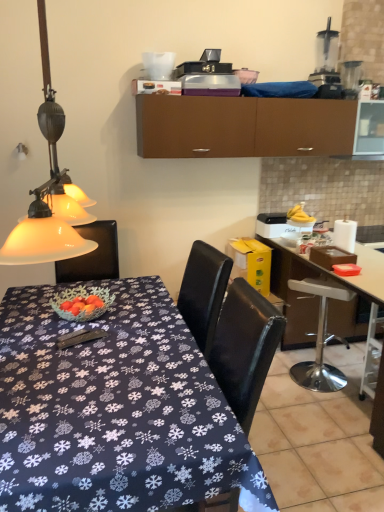
Question: From a real-world perspective, is white glossy desk at right, which is the 2th desk from left to right, beneath transparent plastic blender at upper right, the 2th appliance from the right?

Choices:
 (A) yes
 (B) no

Answer: (A)

Question: Does white glossy desk at right, arranged as the 1th desk when viewed from the right, come in front of transparent plastic blender at upper right, the 2th appliance from the right?

Choices:
 (A) yes
 (B) no

Answer: (A)

Question: Considering the relative sizes of white glossy desk at right, arranged as the 1th desk when viewed from the right, and transparent plastic blender at upper right, the 2th appliance from the right, in the image provided, is white glossy desk at right, arranged as the 1th desk when viewed from the right, bigger than transparent plastic blender at upper right, the 2th appliance from the right,?

Choices:
 (A) yes
 (B) no

Answer: (A)

Question: Is white glossy desk at right, which is the 2th desk from left to right, located outside transparent plastic blender at upper right, the 2th appliance from the right?

Choices:
 (A) no
 (B) yes

Answer: (B)

Question: Is white glossy desk at right, which is the 2th desk from left to right, to the right of transparent plastic blender at upper right, arranged as the first appliance when viewed from the left, from the viewer's perspective?

Choices:
 (A) yes
 (B) no

Answer: (A)

Question: Considering the positions of matte glass lampshade at left and dark blue fabric table at center, which appears as the first desk when viewed from the left, in the image, is matte glass lampshade at left bigger or smaller than dark blue fabric table at center, which appears as the first desk when viewed from the left,?

Choices:
 (A) small
 (B) big

Answer: (A)

Question: Do you think matte glass lampshade at left is within dark blue fabric table at center, which is the second desk in right-to-left order, or outside of it?

Choices:
 (A) outside
 (B) inside

Answer: (A)

Question: Is point (52, 180) positioned closer to the camera than point (104, 286)?

Choices:
 (A) farther
 (B) closer

Answer: (B)

Question: Would you say matte glass lampshade at left is to the left or to the right of dark blue fabric table at center, which is the second desk in right-to-left order, in the picture?

Choices:
 (A) right
 (B) left

Answer: (B)

Question: In the image, is dark blue fabric table at center, which is the second desk in right-to-left order, on the left side or the right side of white glossy desk at right, arranged as the 1th desk when viewed from the right?

Choices:
 (A) left
 (B) right

Answer: (A)

Question: From the image's perspective, is dark blue fabric table at center, which is the second desk in right-to-left order, located above or below white glossy desk at right, which is the 2th desk from left to right?

Choices:
 (A) below
 (B) above

Answer: (A)

Question: Relative to white glossy desk at right, which is the 2th desk from left to right, is dark blue fabric table at center, which appears as the first desk when viewed from the left, in front or behind?

Choices:
 (A) behind
 (B) front

Answer: (B)

Question: From a real-world perspective, is dark blue fabric table at center, which appears as the first desk when viewed from the left, positioned above or below white glossy desk at right, arranged as the 1th desk when viewed from the right?

Choices:
 (A) above
 (B) below

Answer: (B)

Question: Is white plastic chair at right spatially inside brown matte cabinet at upper center, or outside of it?

Choices:
 (A) inside
 (B) outside

Answer: (B)

Question: Visually, is white plastic chair at right positioned to the left or to the right of brown matte cabinet at upper center?

Choices:
 (A) left
 (B) right

Answer: (B)